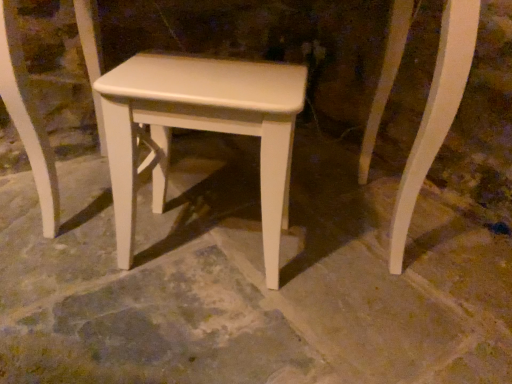
The width and height of the screenshot is (512, 384). In order to click on vacant point to the left of white matte stool at center in this screenshot , I will do `click(59, 281)`.